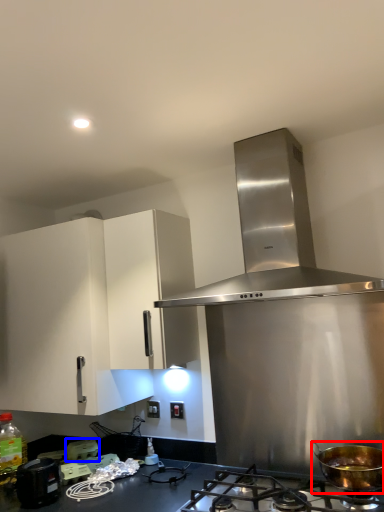
Question: Which of the following is the closest to the observer, kitchen appliance (highlighted by a red box) or appliance (highlighted by a blue box)?

Choices:
 (A) kitchen appliance
 (B) appliance

Answer: (A)